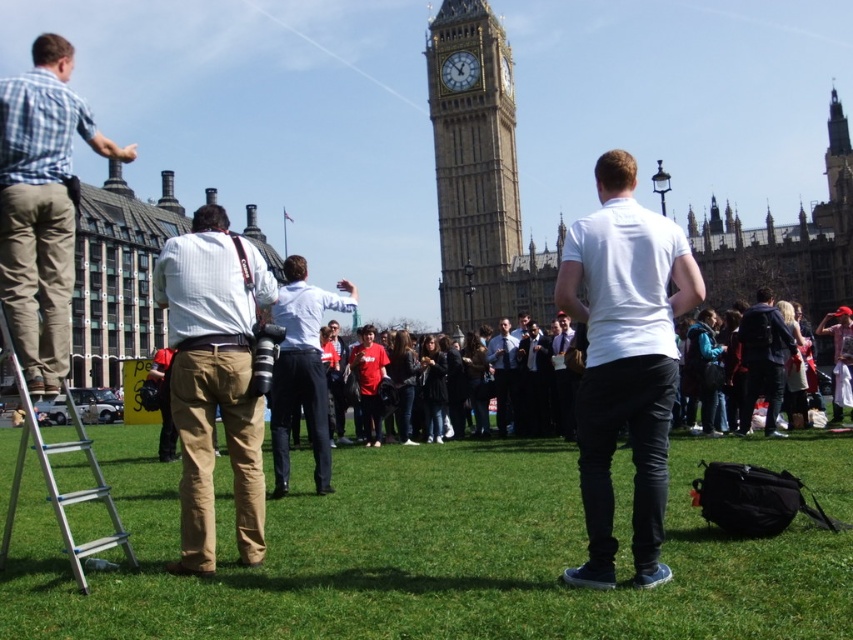
Question: Which is farther from the plaid shirt at left?

Choices:
 (A) dark blue backpack at center
 (B) khaki cotton pants at center
 (C) green grass at center

Answer: (A)

Question: Is khaki cotton pants at center above dark blue backpack at center?

Choices:
 (A) no
 (B) yes

Answer: (A)

Question: Is khaki cotton pants at center bigger than stone clock tower at center?

Choices:
 (A) yes
 (B) no

Answer: (B)

Question: Can you confirm if khaki cotton pants at center is positioned above dark blue backpack at center?

Choices:
 (A) no
 (B) yes

Answer: (A)

Question: Which point is closer to the camera?

Choices:
 (A) (767, 316)
 (B) (57, 451)
 (C) (490, 248)

Answer: (B)

Question: Considering the real-world distances, which object is closest to the silver metallic ladder at left?

Choices:
 (A) plaid shirt at left
 (B) khaki cotton pants at center
 (C) dark blue backpack at center
 (D) white matte shirt at center

Answer: (A)